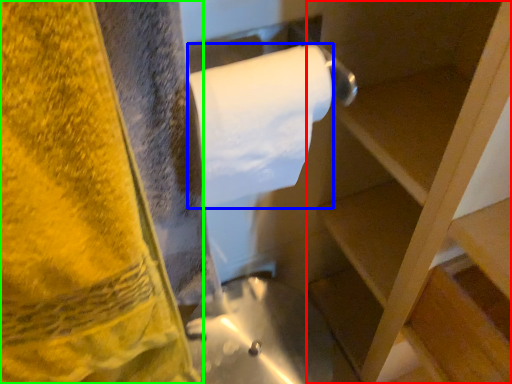
Question: Considering the real-world distances, which object is farthest from shelf (highlighted by a red box)? toilet paper (highlighted by a blue box) or towel (highlighted by a green box)?

Choices:
 (A) toilet paper
 (B) towel

Answer: (B)